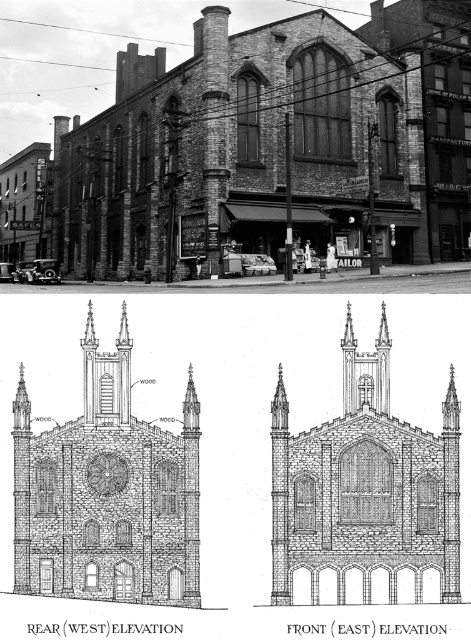
You are standing in front of a building with two churches at its center. The brick church at center and the wooden church at center. Which one is closer to you?

The brick church at center is 10.42 meters away from the wooden church at center, so the wooden church at center is closer to you since it is positioned behind the brick one.

Based on the image provided, which church is positioned lower in the scene? The scene includes a brick church at center and a wooden church at center. Please refer to their positions in the image.

The brick church at center is located below the wooden church at center, so it is positioned lower in the scene.